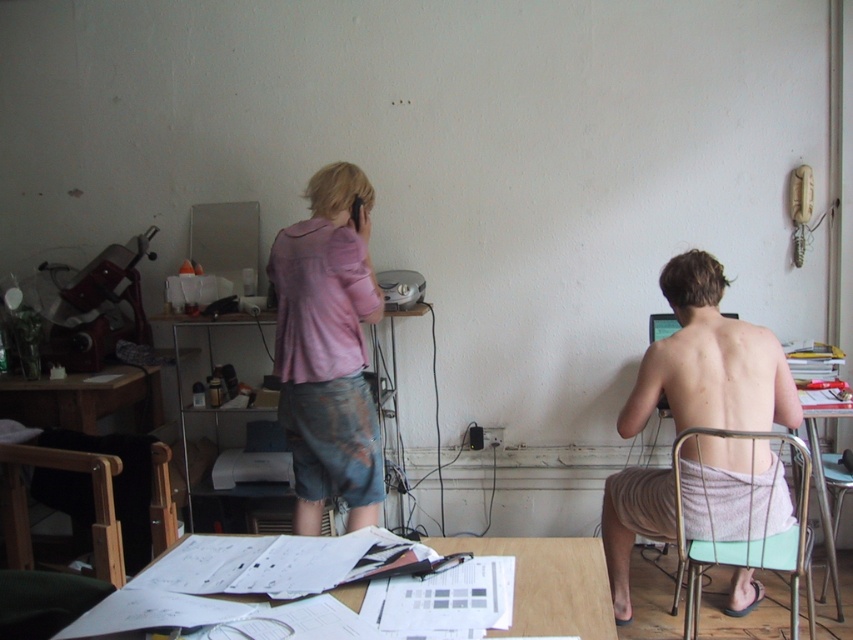
Is point (773, 493) farther from viewer compared to point (799, 502)?

Yes, it is behind point (799, 502).

Can you confirm if gray towel at right is shorter than green plastic chair at lower right?

Incorrect, gray towel at right's height does not fall short of green plastic chair at lower right's.

The image size is (853, 640). Find the location of `gray towel at right`. gray towel at right is located at coordinates (711, 362).

Is white paper at center wider than green plastic chair at lower right?

Incorrect, white paper at center's width does not surpass green plastic chair at lower right's.

Can you confirm if white paper at center is taller than green plastic chair at lower right?

Incorrect, white paper at center's height is not larger of green plastic chair at lower right's.

Is point (570, 593) positioned before point (746, 538)?

Yes.

Where is `white paper at center`? The width and height of the screenshot is (853, 640). white paper at center is located at coordinates (549, 582).

Is pink cotton shirt at center taller than matte plastic printer at center?

Correct, pink cotton shirt at center is much taller as matte plastic printer at center.

In the scene shown: Who is more distant from viewer, (329, 292) or (376, 394)?

Positioned behind is point (376, 394).

Locate an element on the screen. The width and height of the screenshot is (853, 640). pink cotton shirt at center is located at coordinates (328, 349).